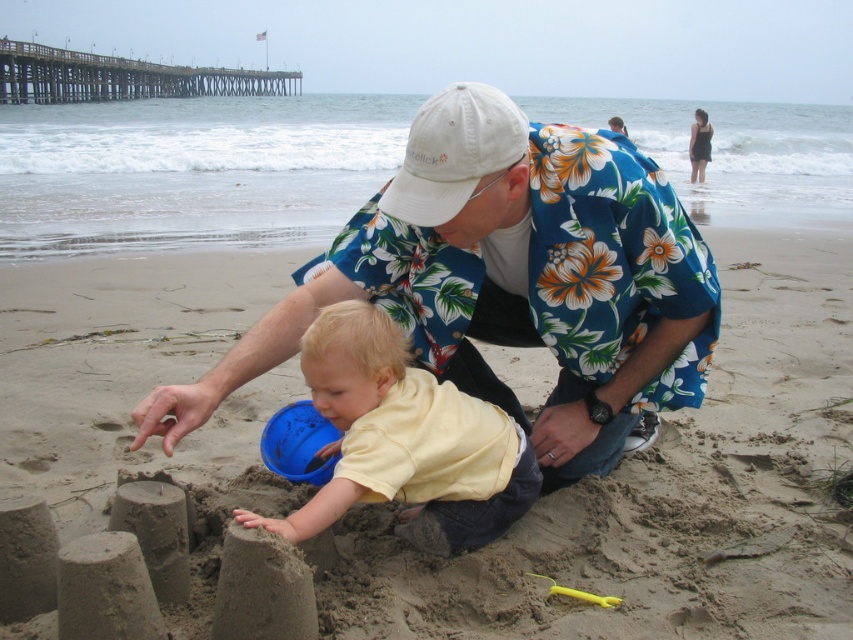
Question: Is smooth sandcastle at center positioned behind yellow matte shirt at center?

Choices:
 (A) no
 (B) yes

Answer: (B)

Question: Which object appears closest to the camera in this image?

Choices:
 (A) floral shirt at center
 (B) blue plastic bucket at center
 (C) white cotton baseball cap at center
 (D) smooth sandcastle at center

Answer: (A)

Question: Considering the real-world distances, which object is closest to the smooth sandcastle at center?

Choices:
 (A) white cotton baseball cap at center
 (B) floral shirt at center
 (C) yellow matte shirt at center
 (D) blue plastic bucket at center

Answer: (D)

Question: Is the position of yellow matte shirt at center less distant than that of white cotton baseball cap at center?

Choices:
 (A) no
 (B) yes

Answer: (B)

Question: Among these objects, which one is nearest to the camera?

Choices:
 (A) white cotton baseball cap at center
 (B) smooth sandcastle at center
 (C) blue plastic bucket at center
 (D) floral shirt at center

Answer: (D)

Question: Can you confirm if floral shirt at center is positioned to the right of yellow plastic shovel at lower center?

Choices:
 (A) yes
 (B) no

Answer: (B)